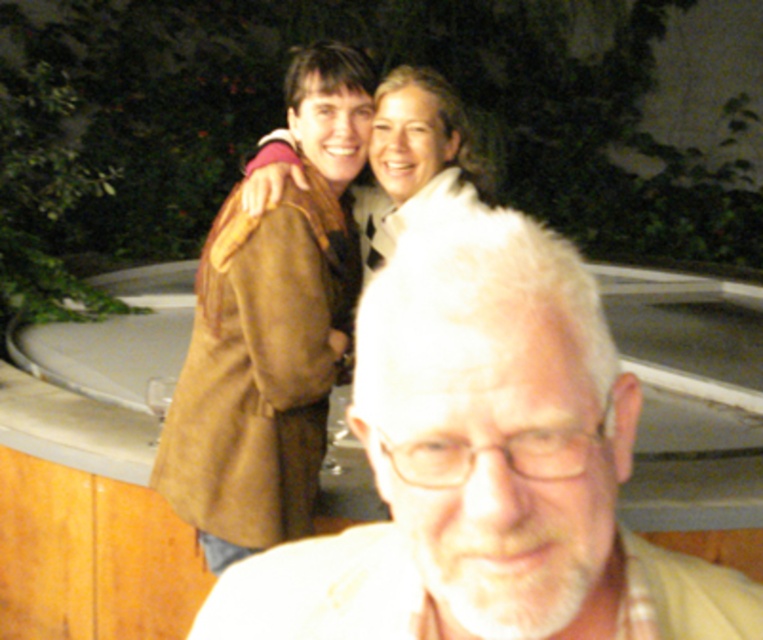
Does brown suede coat at upper center appear on the left side of white fur coat at upper center?

Yes, brown suede coat at upper center is to the left of white fur coat at upper center.

Is point (258, 240) closer to viewer compared to point (414, 144)?

That is True.

You are a GUI agent. You are given a task and a screenshot of the screen. Output one action in this format:
    pyautogui.click(x=<x>, y=<y>)
    Task: Click on the brown suede coat at upper center
    The height and width of the screenshot is (640, 763).
    Given the screenshot: What is the action you would take?
    pyautogui.click(x=271, y=332)

This screenshot has height=640, width=763. Describe the element at coordinates (485, 468) in the screenshot. I see `white matte hair at center` at that location.

Can you confirm if white matte hair at center is smaller than white fur coat at upper center?

Correct, white matte hair at center occupies less space than white fur coat at upper center.

Which is in front, point (385, 355) or point (359, 195)?

Point (385, 355) is in front.

Where is `white matte hair at center`? The height and width of the screenshot is (640, 763). white matte hair at center is located at coordinates (485, 468).

Measure the distance between point (x=523, y=636) and camera.

19.49 inches

Does white matte hair at center have a greater height compared to brown suede coat at upper center?

No.

Does point (285, 564) come closer to viewer compared to point (333, 284)?

Yes, point (285, 564) is closer to viewer.

Where is `white matte hair at center`? This screenshot has height=640, width=763. white matte hair at center is located at coordinates point(485,468).